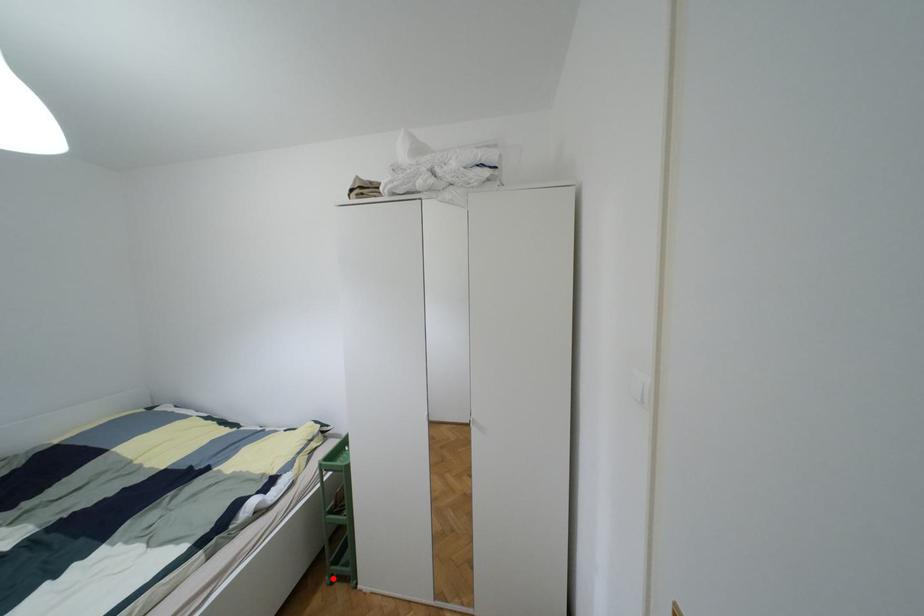
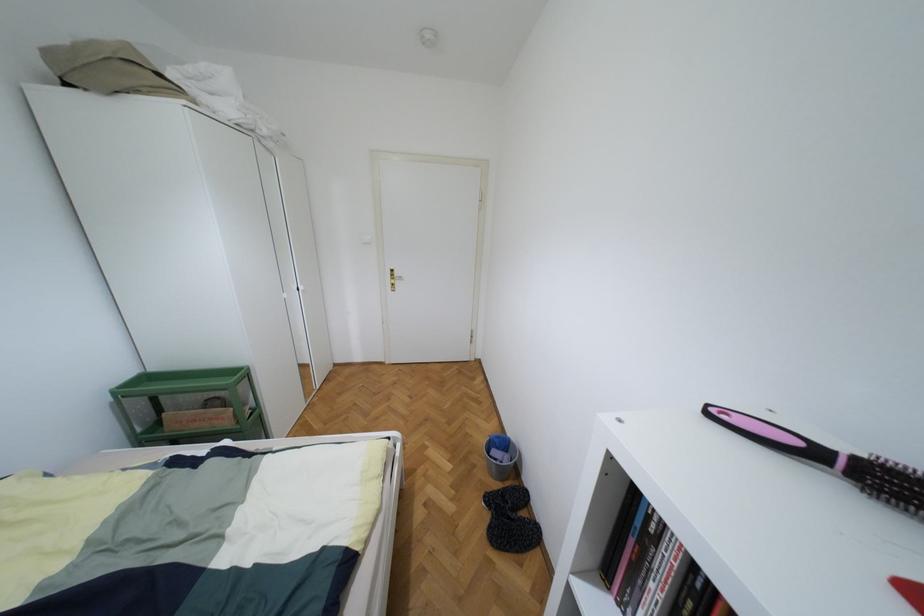
Question: I am providing you with two images of the same scene from different viewpoints. A red point is marked on the first image. Can you still see the location of the red point in image 2?

Choices:
 (A) Yes
 (B) No

Answer: (B)